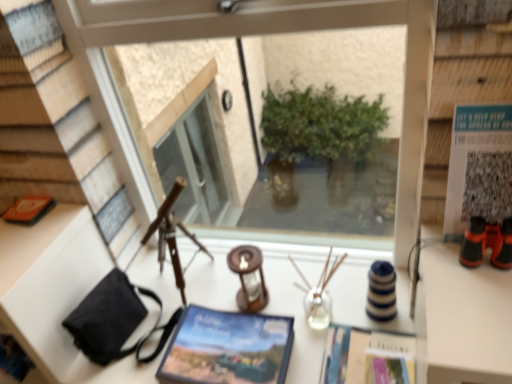
Identify the location of matte blue book at center, the second magazine viewed from the right. The height and width of the screenshot is (384, 512). (227, 348).

What do you see at coordinates (367, 357) in the screenshot? I see `matte paper magazine at center, acting as the 2th magazine starting from the left` at bounding box center [367, 357].

Describe the element at coordinates (479, 166) in the screenshot. The width and height of the screenshot is (512, 384). I see `white paper at upper right` at that location.

This screenshot has height=384, width=512. What do you see at coordinates (256, 34) in the screenshot? I see `transparent glass window at center` at bounding box center [256, 34].

Measure the distance between white matte writing desk at center and camera.

The depth of white matte writing desk at center is 1.06 meters.

Describe the element at coordinates (295, 303) in the screenshot. The width and height of the screenshot is (512, 384). I see `white matte writing desk at center` at that location.

Describe the element at coordinates (29, 209) in the screenshot. I see `orange matte book at left` at that location.

This screenshot has width=512, height=384. Find the location of `translucent glass candle holder at center, which ranks as the 1th candle holder in right-to-left order`. translucent glass candle holder at center, which ranks as the 1th candle holder in right-to-left order is located at coordinates (319, 294).

Is translucent glass candle holder at center, the second candle holder positioned from the left, positioned far away from white paper at upper right?

No.

Who is taller, translucent glass candle holder at center, which ranks as the 1th candle holder in right-to-left order, or white paper at upper right?

white paper at upper right.

Measure the distance from translucent glass candle holder at center, the second candle holder positioned from the left, to white paper at upper right.

translucent glass candle holder at center, the second candle holder positioned from the left, is 19.78 inches away from white paper at upper right.

Which of these two, translucent glass candle holder at center, which ranks as the 1th candle holder in right-to-left order, or white paper at upper right, is thinner?

With smaller width is white paper at upper right.

From the image's perspective, is matte blue book at center, the second magazine viewed from the right, under orange matte book at left?

Yes.

Is there a large distance between matte blue book at center, which appears as the first magazine when viewed from the left, and orange matte book at left?

No, matte blue book at center, which appears as the first magazine when viewed from the left, is in close proximity to orange matte book at left.

Considering the sizes of matte blue book at center, which appears as the first magazine when viewed from the left, and orange matte book at left in the image, is matte blue book at center, which appears as the first magazine when viewed from the left, bigger or smaller than orange matte book at left?

matte blue book at center, which appears as the first magazine when viewed from the left, is bigger than orange matte book at left.

Consider the image. Does matte blue book at center, the second magazine viewed from the right, have a greater width compared to orange matte book at left?

Yes, matte blue book at center, the second magazine viewed from the right, is wider than orange matte book at left.

Considering the positions of objects orange matte book at left and wooden candle holder at center, placed as the first candle holder when sorted from left to right, in the image provided, who is more to the right, orange matte book at left or wooden candle holder at center, placed as the first candle holder when sorted from left to right,?

From the viewer's perspective, wooden candle holder at center, placed as the first candle holder when sorted from left to right, appears more on the right side.

From a real-world perspective, which object rests below the other?

In real-world perspective, wooden candle holder at center, arranged as the 2th candle holder when viewed from the right, is lower.

Between point (22, 205) and point (262, 296), which one is positioned behind?

Positioned behind is point (262, 296).

What's the angular difference between matte paper magazine at center, acting as the 2th magazine starting from the left, and orange matte book at left's facing directions?

0.00112 degrees.

From the image's perspective, is matte paper magazine at center, acting as the 2th magazine starting from the left, over orange matte book at left?

No, from the image's perspective, matte paper magazine at center, acting as the 2th magazine starting from the left, is not on top of orange matte book at left.

Who is smaller, matte paper magazine at center, acting as the 2th magazine starting from the left, or orange matte book at left?

Smaller between the two is orange matte book at left.

How far apart are transparent glass window at center and orange matte book at left?

They are 23.47 inches apart.

Choose the correct answer: Is transparent glass window at center inside orange matte book at left or outside it?

transparent glass window at center exists outside the volume of orange matte book at left.

Would you consider transparent glass window at center to be distant from orange matte book at left?

No, transparent glass window at center is in close proximity to orange matte book at left.

Does transparent glass window at center appear on the right side of orange matte book at left?

Yes, transparent glass window at center is to the right of orange matte book at left.

Is the depth of translucent glass candle holder at center, which ranks as the 1th candle holder in right-to-left order, greater than that of wooden candle holder at center, placed as the first candle holder when sorted from left to right?

No, it is in front of wooden candle holder at center, placed as the first candle holder when sorted from left to right.

From the image's perspective, which object appears higher, translucent glass candle holder at center, the second candle holder positioned from the left, or wooden candle holder at center, arranged as the 2th candle holder when viewed from the right?

wooden candle holder at center, arranged as the 2th candle holder when viewed from the right.

Can you confirm if translucent glass candle holder at center, the second candle holder positioned from the left, is shorter than wooden candle holder at center, arranged as the 2th candle holder when viewed from the right?

No.

Does point (155, 290) lie in front of point (252, 364)?

No, (155, 290) is further to viewer.

Would you say white matte writing desk at center is inside or outside matte blue book at center, the second magazine viewed from the right?

white matte writing desk at center is not enclosed by matte blue book at center, the second magazine viewed from the right.

Considering the sizes of objects white matte writing desk at center and matte blue book at center, which appears as the first magazine when viewed from the left, in the image provided, who is smaller, white matte writing desk at center or matte blue book at center, which appears as the first magazine when viewed from the left,?

With smaller size is matte blue book at center, which appears as the first magazine when viewed from the left.

Does white matte writing desk at center have a lesser width compared to matte blue book at center, the second magazine viewed from the right?

No, white matte writing desk at center is not thinner than matte blue book at center, the second magazine viewed from the right.

At what (x,y) coordinates should I click in order to perform the action: click on paperback book positioned vertically above the translucent glass candle holder at center, which ranks as the 1th candle holder in right-to-left order (from a real-world perspective). Please return your answer as a coordinate pair (x, y). Looking at the image, I should click on (479, 166).

Find the location of a particular element. book above the matte blue book at center, the second magazine viewed from the right (from the image's perspective) is located at coordinates (29, 209).

Which object lies further to the anchor point matte paper magazine at center, the first magazine positioned from the right, white paper at upper right or white matte writing desk at center?

white paper at upper right is positioned further to the anchor matte paper magazine at center, the first magazine positioned from the right.

From the image, which object appears to be nearer to white paper at upper right, white matte writing desk at center or translucent glass candle holder at center, which ranks as the 1th candle holder in right-to-left order?

translucent glass candle holder at center, which ranks as the 1th candle holder in right-to-left order, is positioned closer to the anchor white paper at upper right.

From the image, which object appears to be nearer to white matte writing desk at center, orange matte book at left or matte paper magazine at center, acting as the 2th magazine starting from the left?

Based on the image, matte paper magazine at center, acting as the 2th magazine starting from the left, appears to be nearer to white matte writing desk at center.

Based on their spatial positions, is white paper at upper right or white matte writing desk at center closer to wooden candle holder at center, arranged as the 2th candle holder when viewed from the right?

white matte writing desk at center is positioned closer to the anchor wooden candle holder at center, arranged as the 2th candle holder when viewed from the right.

Looking at the image, which one is located closer to orange matte book at left, matte paper magazine at center, acting as the 2th magazine starting from the left, or wooden candle holder at center, arranged as the 2th candle holder when viewed from the right?

wooden candle holder at center, arranged as the 2th candle holder when viewed from the right.

Looking at the image, which one is located closer to wooden candle holder at center, arranged as the 2th candle holder when viewed from the right, orange matte book at left or matte paper magazine at center, acting as the 2th magazine starting from the left?

Based on the image, matte paper magazine at center, acting as the 2th magazine starting from the left, appears to be nearer to wooden candle holder at center, arranged as the 2th candle holder when viewed from the right.

Which object lies nearer to the anchor point white paper at upper right, orange matte book at left or white matte writing desk at center?

The object closer to white paper at upper right is white matte writing desk at center.

Consider the image. From the image, which object appears to be nearer to white matte writing desk at center, translucent glass candle holder at center, the second candle holder positioned from the left, or wooden candle holder at center, placed as the first candle holder when sorted from left to right?

translucent glass candle holder at center, the second candle holder positioned from the left, lies closer to white matte writing desk at center than the other object.

I want to click on candle holder situated between transparent glass window at center and white paper at upper right from left to right, so 319,294.

The width and height of the screenshot is (512, 384). Find the location of `candle holder between wooden candle holder at center, arranged as the 2th candle holder when viewed from the right, and matte paper magazine at center, the first magazine positioned from the right, from left to right`. candle holder between wooden candle holder at center, arranged as the 2th candle holder when viewed from the right, and matte paper magazine at center, the first magazine positioned from the right, from left to right is located at coordinates (319, 294).

You are a GUI agent. You are given a task and a screenshot of the screen. Output one action in this format:
    pyautogui.click(x=<x>, y=<y>)
    Task: Click on the writing desk between orange matte book at left and transparent glass window at center
    The width and height of the screenshot is (512, 384).
    Given the screenshot: What is the action you would take?
    pyautogui.click(x=295, y=303)

Identify the location of magazine between white matte writing desk at center and matte paper magazine at center, acting as the 2th magazine starting from the left, from left to right. The height and width of the screenshot is (384, 512). (227, 348).